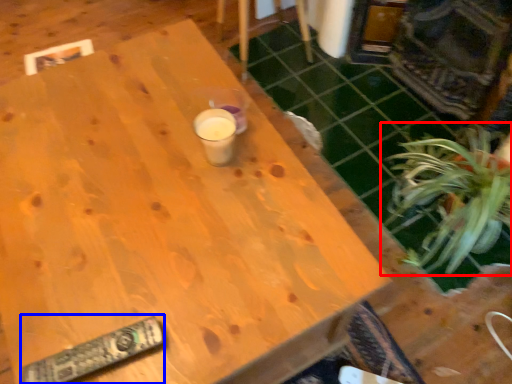
Question: Among these objects, which one is nearest to the camera, houseplant (highlighted by a red box) or remote (highlighted by a blue box)?

Choices:
 (A) houseplant
 (B) remote

Answer: (B)